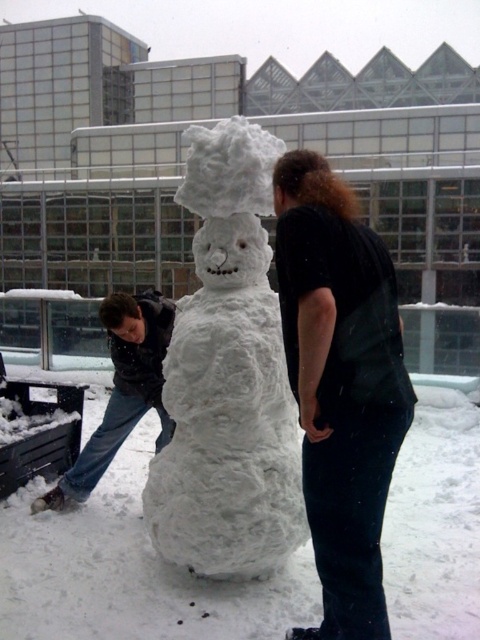
Is the position of white fluffy snowman at center less distant than that of dark gray jacket at left?

That is True.

Is point (245, 444) closer to viewer compared to point (82, 497)?

Yes, point (245, 444) is closer to viewer.

Describe the element at coordinates (228, 376) in the screenshot. The image size is (480, 640). I see `white fluffy snowman at center` at that location.

The width and height of the screenshot is (480, 640). I want to click on white fluffy snowman at center, so click(228, 376).

Can you confirm if black matte vest at center is positioned below dark gray jacket at left?

Actually, black matte vest at center is above dark gray jacket at left.

Does point (398, 324) lie behind point (99, 477)?

No, it is not.

I want to click on black matte vest at center, so click(340, 385).

Between point (199, 310) and point (372, 618), which one is positioned in front?

Positioned in front is point (372, 618).

Image resolution: width=480 pixels, height=640 pixels. Find the location of `white fluffy snowman at center`. white fluffy snowman at center is located at coordinates (228, 376).

Identify the location of white fluffy snowman at center. (228, 376).